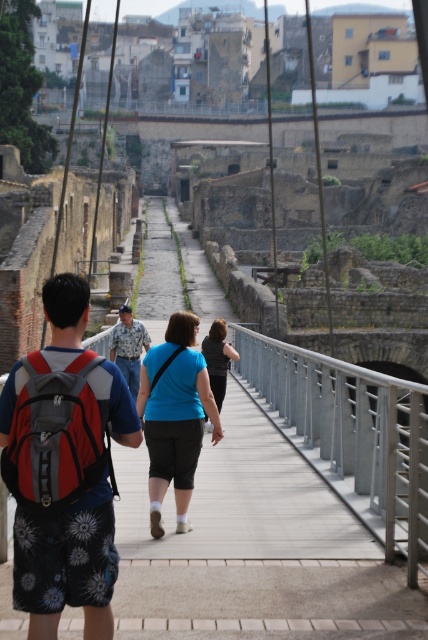
Can you confirm if blue matte shirt at center is wider than camouflage uniform at center?

Yes, blue matte shirt at center is wider than camouflage uniform at center.

Is blue matte shirt at center taller than camouflage uniform at center?

Yes, blue matte shirt at center is taller than camouflage uniform at center.

Between point (184, 502) and point (133, 387), which one is positioned behind?

Positioned behind is point (133, 387).

Locate an element on the screen. The width and height of the screenshot is (428, 640). blue matte shirt at center is located at coordinates (175, 416).

Describe the element at coordinates (48, 470) in the screenshot. The height and width of the screenshot is (640, 428). I see `red fabric backpack at center` at that location.

The height and width of the screenshot is (640, 428). Find the location of `red fabric backpack at center`. red fabric backpack at center is located at coordinates (48, 470).

Does point (44, 413) come behind point (128, 349)?

No, it is not.

Between point (55, 429) and point (124, 307), which one is positioned behind?

The point (124, 307) is behind.

Find the location of a particular element. The image size is (428, 640). red fabric backpack at center is located at coordinates (48, 470).